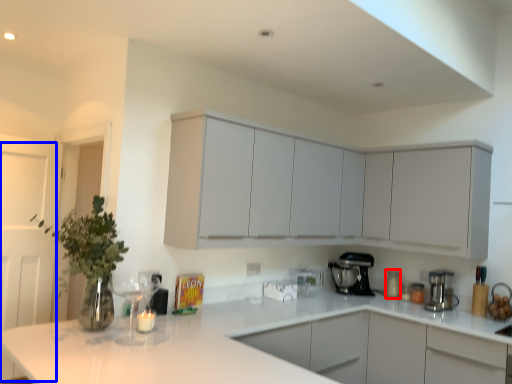
Question: Which object is closer to the camera taking this photo, appliance (highlighted by a red box) or glass door (highlighted by a blue box)?

Choices:
 (A) appliance
 (B) glass door

Answer: (B)